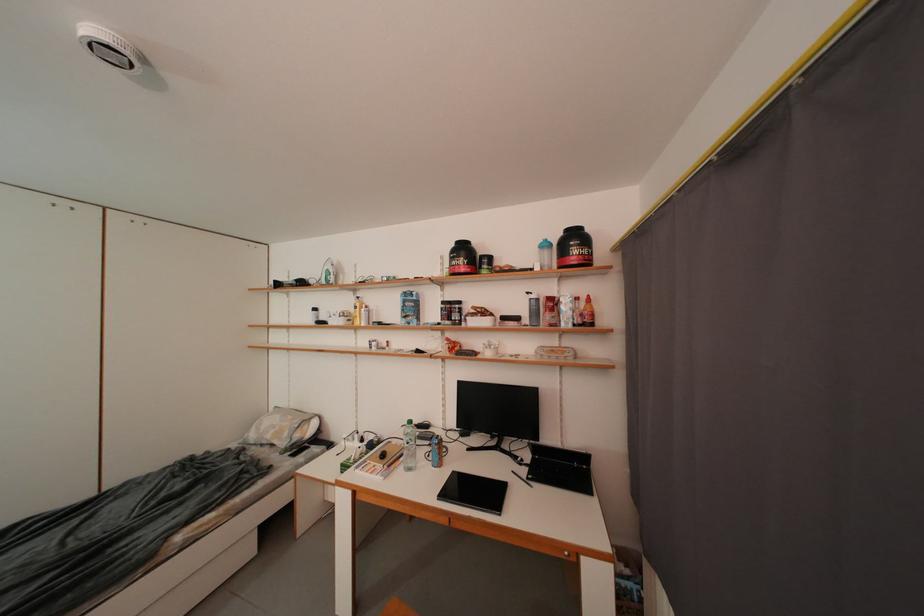
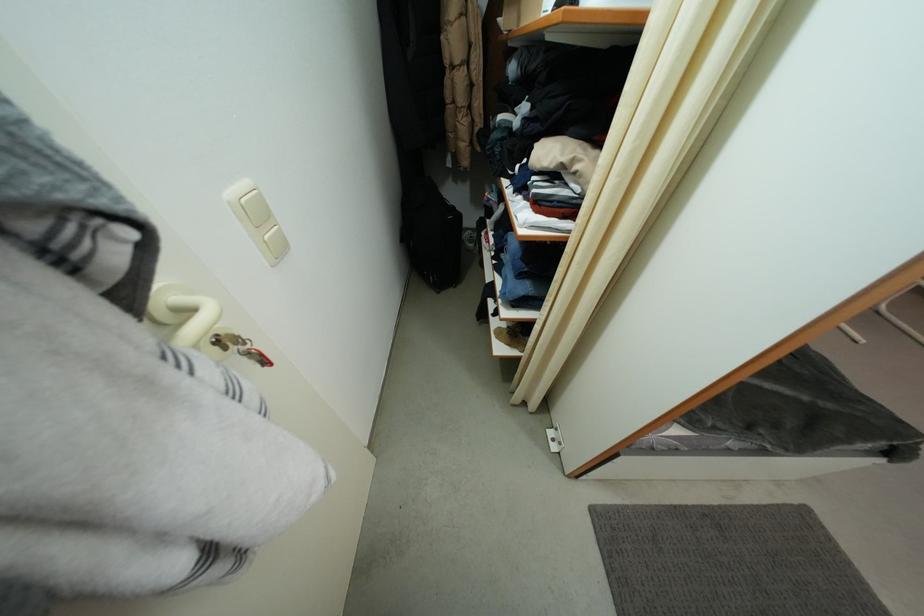
Question: I am providing you with two images of the same scene from different viewpoints. Please identify which objects are invisible in image2.

Choices:
 (A) light switch button
 (B) white pitcher handle
 (C) white spiral notebook
 (D) brown leather shoe

Answer: (C)